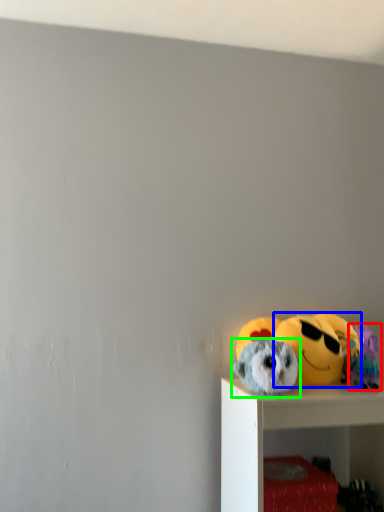
Question: Which is farther away from toy (highlighted by a red box)? toy (highlighted by a blue box) or toy (highlighted by a green box)?

Choices:
 (A) toy
 (B) toy

Answer: (B)